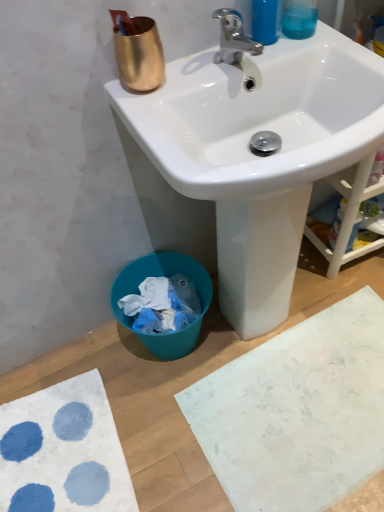
In order to click on unoccupied area in front of translucent blue liquid at upper right in this screenshot , I will do `click(309, 49)`.